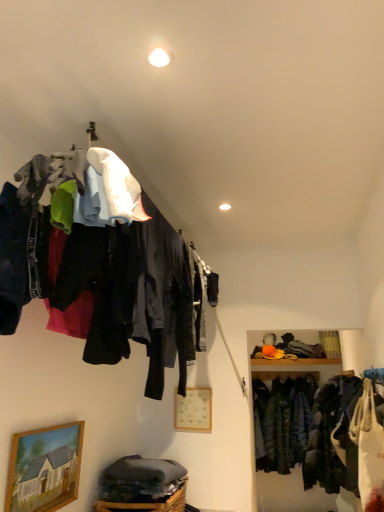
In order to face dark green quilted jacket at lower right, should I rotate leftwards or rightwards?

To face it directly, rotate right by 13.602 degrees.

What is the approximate height of dark green quilted jacket at lower right?

dark green quilted jacket at lower right is 1.14 meters in height.

This screenshot has height=512, width=384. Describe the element at coordinates (193, 410) in the screenshot. I see `wooden picture frame at center, which ranks as the 2th picture frame in left-to-right order` at that location.

What is the approximate height of woven brown basket at lower center?

It is 10.42 inches.

Describe the element at coordinates (148, 503) in the screenshot. This screenshot has width=384, height=512. I see `woven brown basket at lower center` at that location.

Identify the location of dark green quilted jacket at lower right. The width and height of the screenshot is (384, 512). (282, 422).

From the picture: Is wooden framed painting at lower left, arranged as the second picture frame when viewed from the right, positioned beyond the bounds of wooden picture frame at center, the first picture frame when ordered from right to left?

Indeed, wooden framed painting at lower left, arranged as the second picture frame when viewed from the right, is completely outside wooden picture frame at center, the first picture frame when ordered from right to left.

Is wooden framed painting at lower left, which ranks as the first picture frame in front-to-back order, oriented away from wooden picture frame at center, acting as the first picture frame starting from the back?

That's not correct — wooden framed painting at lower left, which ranks as the first picture frame in front-to-back order, is not looking away from wooden picture frame at center, acting as the first picture frame starting from the back.

Is point (68, 430) closer or farther from the camera than point (205, 395)?

Point (68, 430) appears to be closer to the viewer than point (205, 395).

Is wooden framed painting at lower left, the 2th picture frame from the back, not close to wooden picture frame at center, the first picture frame when ordered from right to left?

Yes.

From a real-world perspective, is woven brown basket at lower center on wooden framed painting at lower left, which ranks as the first picture frame in front-to-back order?

No.

Looking at this image, does woven brown basket at lower center have a lesser height compared to wooden framed painting at lower left, which ranks as the first picture frame in front-to-back order?

Indeed, woven brown basket at lower center has a lesser height compared to wooden framed painting at lower left, which ranks as the first picture frame in front-to-back order.

Based on the photo, how distant is woven brown basket at lower center from wooden framed painting at lower left, which is the first picture frame in left-to-right order?

19.96 inches.

Are woven brown basket at lower center and wooden framed painting at lower left, which ranks as the first picture frame in front-to-back order, located far from each other?

No, woven brown basket at lower center is not far from wooden framed painting at lower left, which ranks as the first picture frame in front-to-back order.

Which object is wider, wooden picture frame at center, acting as the first picture frame starting from the back, or matte fabric clothes at upper left?

matte fabric clothes at upper left.

In the scene shown: From the image's perspective, between wooden picture frame at center, acting as the first picture frame starting from the back, and matte fabric clothes at upper left, who is located below?

From the image's view, wooden picture frame at center, acting as the first picture frame starting from the back, is below.

You are a GUI agent. You are given a task and a screenshot of the screen. Output one action in this format:
    pyautogui.click(x=<x>, y=<y>)
    Task: Click on the closet in front of the wooden picture frame at center, the first picture frame when ordered from right to left
    The height and width of the screenshot is (512, 384).
    Given the screenshot: What is the action you would take?
    pyautogui.click(x=100, y=265)

Is wooden picture frame at center, the first picture frame when ordered from right to left, closer to the viewer compared to matte fabric clothes at upper left?

No, the depth of wooden picture frame at center, the first picture frame when ordered from right to left, is greater than that of matte fabric clothes at upper left.

Considering the sizes of objects wooden picture frame at center, which ranks as the 2th picture frame in left-to-right order, and woven brown basket at lower center in the image provided, who is taller, wooden picture frame at center, which ranks as the 2th picture frame in left-to-right order, or woven brown basket at lower center?

wooden picture frame at center, which ranks as the 2th picture frame in left-to-right order.

Which point is more forward, (189, 400) or (108, 502)?

The point (108, 502) is closer to the camera.

Considering the relative sizes of wooden picture frame at center, placed as the second picture frame when sorted from front to back, and woven brown basket at lower center in the image provided, is wooden picture frame at center, placed as the second picture frame when sorted from front to back, smaller than woven brown basket at lower center?

Indeed, wooden picture frame at center, placed as the second picture frame when sorted from front to back, has a smaller size compared to woven brown basket at lower center.

From a real-world perspective, is matte fabric clothes at upper left on woven brown basket at lower center?

Yes, from a real-world perspective, matte fabric clothes at upper left is on top of woven brown basket at lower center.

Is matte fabric clothes at upper left looking in the opposite direction of woven brown basket at lower center?

matte fabric clothes at upper left is not turned away from woven brown basket at lower center.

From the image's perspective, which is above, matte fabric clothes at upper left or woven brown basket at lower center?

matte fabric clothes at upper left, from the image's perspective.

Who is more distant, matte fabric clothes at upper left or woven brown basket at lower center?

woven brown basket at lower center is further away from the camera.

Can you tell me how much wooden framed painting at lower left, which is the first picture frame in left-to-right order, and matte fabric clothes at upper left differ in facing direction?

2.04 degrees separate the facing orientations of wooden framed painting at lower left, which is the first picture frame in left-to-right order, and matte fabric clothes at upper left.

Looking at this image, which point is more forward, [37,443] or [7,187]?

The point [7,187] is in front.

Is wooden framed painting at lower left, the 2th picture frame from the back, smaller than matte fabric clothes at upper left?

Indeed, wooden framed painting at lower left, the 2th picture frame from the back, has a smaller size compared to matte fabric clothes at upper left.

Does wooden framed painting at lower left, the 2th picture frame from the back, touch matte fabric clothes at upper left?

They are not placed beside each other.

Considering the points (265, 449) and (176, 278), which point is behind, point (265, 449) or point (176, 278)?

The point (265, 449) is farther from the camera.

Could you tell me if dark green quilted jacket at lower right is facing matte fabric clothes at upper left?

Yes, dark green quilted jacket at lower right is facing matte fabric clothes at upper left.

Is dark green quilted jacket at lower right taller or shorter than matte fabric clothes at upper left?

Considering their sizes, dark green quilted jacket at lower right has more height than matte fabric clothes at upper left.

Between dark green quilted jacket at lower right and matte fabric clothes at upper left, which one has smaller size?

Smaller between the two is dark green quilted jacket at lower right.

This screenshot has height=512, width=384. In order to click on picture frame behind the wooden framed painting at lower left, which is the first picture frame in left-to-right order in this screenshot , I will do `click(193, 410)`.

The width and height of the screenshot is (384, 512). In order to click on basket on the right side of wooden framed painting at lower left, arranged as the second picture frame when viewed from the right in this screenshot , I will do `click(148, 503)`.

When comparing their distances from wooden framed painting at lower left, which is the first picture frame in left-to-right order, does woven brown basket at lower center or matte fabric clothes at upper left seem closer?

Based on the image, woven brown basket at lower center appears to be nearer to wooden framed painting at lower left, which is the first picture frame in left-to-right order.

Which object lies further to the anchor point wooden framed painting at lower left, arranged as the second picture frame when viewed from the right, wooden picture frame at center, which ranks as the 2th picture frame in left-to-right order, or woven brown basket at lower center?

Based on the image, wooden picture frame at center, which ranks as the 2th picture frame in left-to-right order, appears to be further to wooden framed painting at lower left, arranged as the second picture frame when viewed from the right.

Looking at the image, which one is located closer to wooden picture frame at center, which ranks as the 2th picture frame in left-to-right order, dark green quilted jacket at lower right or wooden framed painting at lower left, which ranks as the first picture frame in front-to-back order?

Based on the image, wooden framed painting at lower left, which ranks as the first picture frame in front-to-back order, appears to be nearer to wooden picture frame at center, which ranks as the 2th picture frame in left-to-right order.

Which object lies further to the anchor point dark green quilted jacket at lower right, matte fabric clothes at upper left or woven brown basket at lower center?

Among the two, matte fabric clothes at upper left is located further to dark green quilted jacket at lower right.

Based on their spatial positions, is wooden picture frame at center, the first picture frame when ordered from right to left, or matte fabric clothes at upper left further from dark green quilted jacket at lower right?

matte fabric clothes at upper left is further to dark green quilted jacket at lower right.

Which object lies further to the anchor point wooden framed painting at lower left, arranged as the second picture frame when viewed from the right, dark green quilted jacket at lower right or woven brown basket at lower center?

dark green quilted jacket at lower right is positioned further to the anchor wooden framed painting at lower left, arranged as the second picture frame when viewed from the right.

From the image, which object appears to be farther from wooden picture frame at center, the first picture frame when ordered from right to left, woven brown basket at lower center or dark green quilted jacket at lower right?

dark green quilted jacket at lower right.

In the scene shown: From the image, which object appears to be farther from matte fabric clothes at upper left, wooden framed painting at lower left, which ranks as the first picture frame in front-to-back order, or dark green quilted jacket at lower right?

dark green quilted jacket at lower right.

What are the coordinates of `picture frame located between wooden framed painting at lower left, which is the first picture frame in left-to-right order, and dark green quilted jacket at lower right in the depth direction` in the screenshot? It's located at (193, 410).

Image resolution: width=384 pixels, height=512 pixels. What are the coordinates of `basket located between matte fabric clothes at upper left and wooden picture frame at center, which ranks as the 2th picture frame in left-to-right order, in the depth direction` in the screenshot? It's located at (148, 503).

The width and height of the screenshot is (384, 512). Identify the location of basket positioned between matte fabric clothes at upper left and dark green quilted jacket at lower right from near to far. (148, 503).

Identify the location of basket between wooden framed painting at lower left, the 2th picture frame from the back, and wooden picture frame at center, the first picture frame when ordered from right to left, along the z-axis. The height and width of the screenshot is (512, 384). (148, 503).